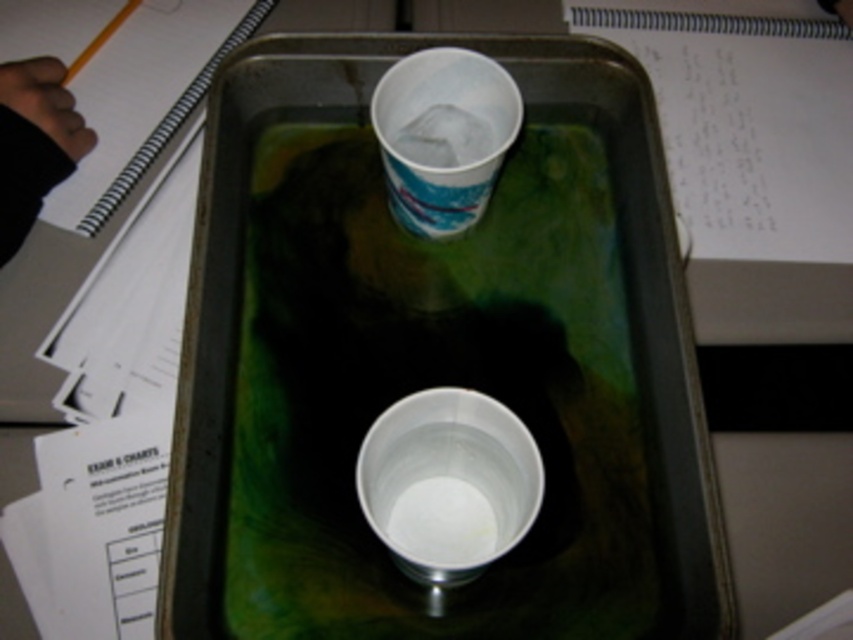
Looking at this image, between white paper cup at upper center and white spiral notebook at upper left, which one has less height?

Standing shorter between the two is white paper cup at upper center.

The height and width of the screenshot is (640, 853). I want to click on white paper cup at upper center, so click(444, 134).

Is white paper cup at upper center below white plastic cup at center?

No, white paper cup at upper center is not below white plastic cup at center.

Is white paper cup at upper center shorter than white plastic cup at center?

No, white paper cup at upper center is not shorter than white plastic cup at center.

Is point (473, 58) positioned after point (467, 435)?

Yes, point (473, 58) is farther from viewer.

The image size is (853, 640). Identify the location of white paper cup at upper center. (444, 134).

Which is in front, point (535, 230) or point (521, 518)?

Positioned in front is point (521, 518).

How distant is metallic silver tray at center from white plastic cup at center?

metallic silver tray at center and white plastic cup at center are 5.51 inches apart from each other.

I want to click on metallic silver tray at center, so click(x=436, y=358).

Where is `metallic silver tray at center`? This screenshot has height=640, width=853. metallic silver tray at center is located at coordinates (436, 358).